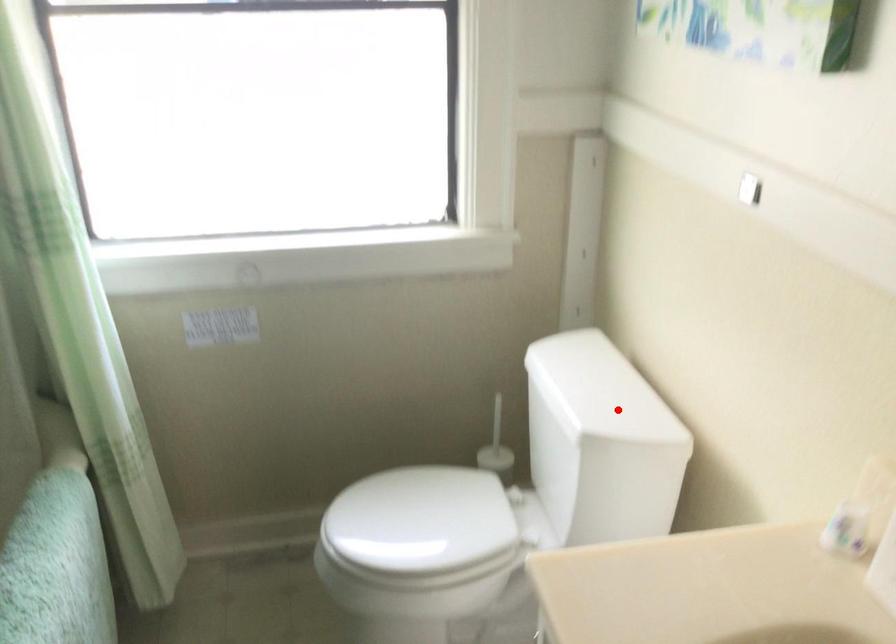
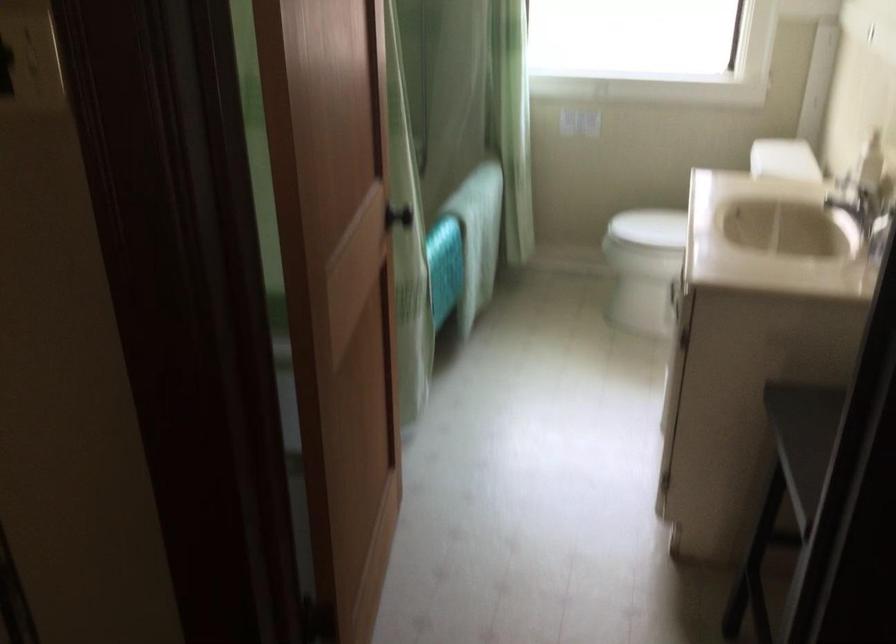
Question: I am providing you with two images of the same scene from different viewpoints. Image1 has a red point marked. In image2, the corresponding 3D location appears at what relative position? Reply with the corresponding letter.

Choices:
 (A) Closer
 (B) Farther

Answer: (B)